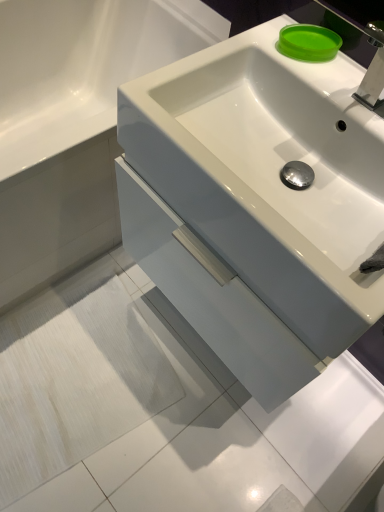
This screenshot has width=384, height=512. Find the location of `white glossy cabinet at center`. white glossy cabinet at center is located at coordinates (74, 122).

In order to click on white glossy sink at center in this screenshot , I will do `click(256, 205)`.

Does white glossy cabinet at center touch green matte soap at upper right?

No, white glossy cabinet at center is not beside green matte soap at upper right.

Would you say white glossy cabinet at center contains green matte soap at upper right?

No, green matte soap at upper right is not a part of white glossy cabinet at center.

What are the coordinates of `soap lying on the right of white glossy cabinet at center` in the screenshot? It's located at [308, 42].

Is white glossy cabinet at center in front of green matte soap at upper right?

Yes, it is.

Can you tell me how much white glossy sink at center and green matte soap at upper right differ in facing direction?

40.2 degrees separate the facing orientations of white glossy sink at center and green matte soap at upper right.

Is white glossy sink at center next to green matte soap at upper right and touching it?

No, white glossy sink at center is not in contact with green matte soap at upper right.

From their relative heights in the image, would you say white glossy sink at center is taller or shorter than green matte soap at upper right?

In the image, white glossy sink at center appears to be taller than green matte soap at upper right.

Is the depth of white glossy sink at center greater than that of green matte soap at upper right?

That is False.

Does green matte soap at upper right contain white glossy sink at center?

No, white glossy sink at center is located outside of green matte soap at upper right.

From a real-world perspective, is green matte soap at upper right physically above white glossy sink at center?

Yes.

Is green matte soap at upper right next to white glossy sink at center and touching it?

green matte soap at upper right and white glossy sink at center are not in contact.

Is point (180, 5) less distant than point (360, 185)?

No, (180, 5) is behind (360, 185).

From the image's perspective, does white glossy cabinet at center appear lower than white glossy sink at center?

Incorrect, from the image's perspective, white glossy cabinet at center is higher than white glossy sink at center.

Is white glossy cabinet at center wider than white glossy sink at center?

Yes, white glossy cabinet at center is wider than white glossy sink at center.

Considering the positions of objects green matte soap at upper right and white glossy cabinet at center in the image provided, who is more to the left, green matte soap at upper right or white glossy cabinet at center?

white glossy cabinet at center is more to the left.

Is green matte soap at upper right taller or shorter than white glossy cabinet at center?

green matte soap at upper right is shorter than white glossy cabinet at center.

From the image's perspective, is green matte soap at upper right positioned above or below white glossy cabinet at center?

green matte soap at upper right is above white glossy cabinet at center.

Could you tell me if green matte soap at upper right is turned towards white glossy cabinet at center?

No, green matte soap at upper right is not facing towards white glossy cabinet at center.

Are white glossy sink at center and white glossy cabinet at center located far from each other?

Actually, white glossy sink at center and white glossy cabinet at center are a little close together.

Is white glossy sink at center closer to camera compared to white glossy cabinet at center?

Yes.

Which object is thinner, white glossy sink at center or white glossy cabinet at center?

white glossy sink at center is thinner.

Is white glossy cabinet at center surrounded by white glossy sink at center?

That's incorrect, white glossy cabinet at center is not inside white glossy sink at center.

Identify the location of soap located behind the white glossy cabinet at center. The image size is (384, 512). (308, 42).

Where is `soap located on the right of white glossy sink at center`? soap located on the right of white glossy sink at center is located at coordinates (308, 42).

Estimate the real-world distances between objects in this image. Which object is further from white glossy cabinet at center, green matte soap at upper right or white glossy sink at center?

The object further to white glossy cabinet at center is green matte soap at upper right.

Which object lies nearer to the anchor point white glossy cabinet at center, white glossy sink at center or green matte soap at upper right?

Based on the image, white glossy sink at center appears to be nearer to white glossy cabinet at center.

From the picture: From the image, which object appears to be nearer to white glossy sink at center, white glossy cabinet at center or green matte soap at upper right?

Based on the image, green matte soap at upper right appears to be nearer to white glossy sink at center.

Which object lies nearer to the anchor point white glossy sink at center, green matte soap at upper right or white glossy cabinet at center?

green matte soap at upper right lies closer to white glossy sink at center than the other object.

Which object lies nearer to the anchor point green matte soap at upper right, white glossy sink at center or white glossy cabinet at center?

white glossy sink at center.

From the image, which object appears to be farther from green matte soap at upper right, white glossy cabinet at center or white glossy sink at center?

white glossy cabinet at center is positioned further to the anchor green matte soap at upper right.

This screenshot has height=512, width=384. Find the location of `sink between white glossy cabinet at center and green matte soap at upper right in the horizontal direction`. sink between white glossy cabinet at center and green matte soap at upper right in the horizontal direction is located at coordinates (256, 205).